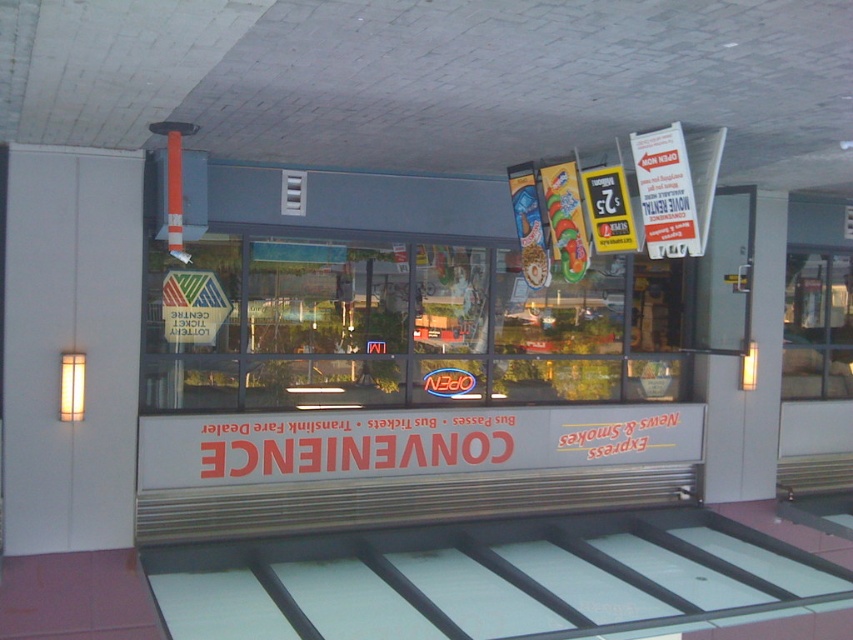
How much distance is there between white paper sign at upper right and yellow paper sign at center?

white paper sign at upper right is 11.28 inches from yellow paper sign at center.

Is point (682, 250) positioned before point (598, 237)?

That is True.

The width and height of the screenshot is (853, 640). What are the coordinates of `white paper sign at upper right` in the screenshot? It's located at (665, 193).